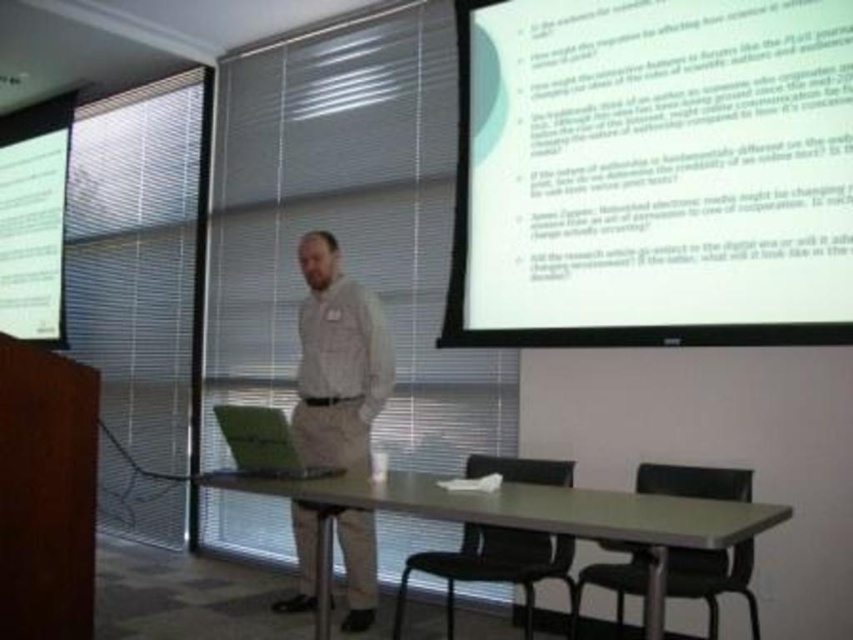
You are a photographer setting up for a presentation. You need to place two markers at point (752, 276) and point (300, 556). Which point is closer to your camera?

Point (752, 276) is closer to the camera than point (300, 556).

You are setting up for a presentation and need to place a large projector on the table. Given that the metallic gray table at center is larger than the green matte laptop at center, will there be enough space for the projector next to the laptop?

The metallic gray table at center is larger in size than the green matte laptop at center, so there should be sufficient space to place the projector next to the laptop.

Looking at this image, you are an attendee at the presentation. You need to place a 15 cm tall notebook on the metallic gray table at center without it being hidden by the light beige shirt at center. Is this possible?

The metallic gray table at center has a lesser height compared to light beige shirt at center. Since the shirt is taller than the table, placing the notebook on the table would not be hidden by the shirt as the shirt is taller, so the notebook will be visible.